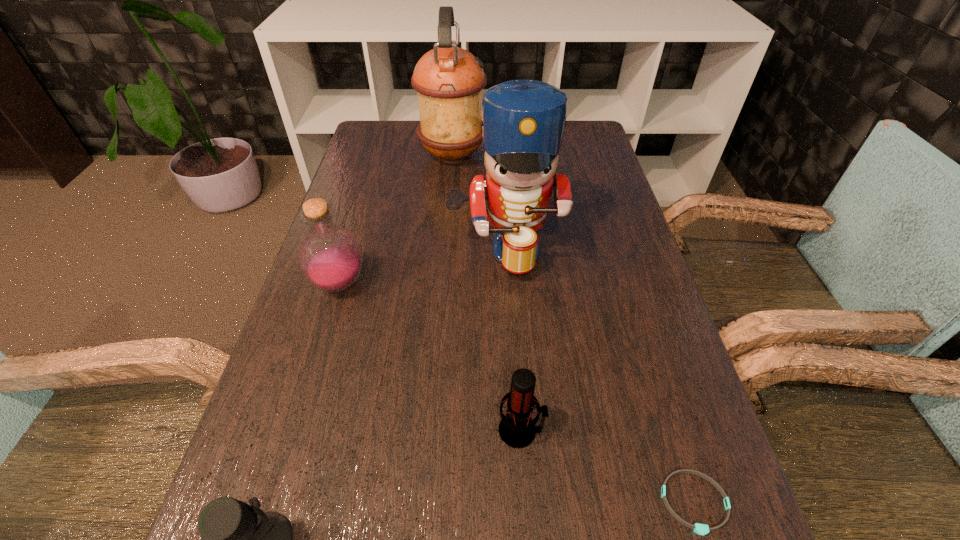
At what (x,y) coordinates should I click in order to perform the action: click on free region located on the left of the right microphone. Please return your answer as a coordinate pair (x, y). Looking at the image, I should click on (323, 430).

This screenshot has height=540, width=960. Find the location of `object that is at the far edge`. object that is at the far edge is located at coordinates (449, 80).

Find the location of a particular element. The image size is (960, 540). object positioned at the left edge is located at coordinates (330, 257).

Where is `object that is positioned at the right edge`? object that is positioned at the right edge is located at coordinates (702, 529).

Identify the location of free space at the left edge of the desktop. [379, 254].

Locate an element on the screen. Image resolution: width=960 pixels, height=540 pixels. free location at the right edge is located at coordinates (589, 159).

At what (x,y) coordinates should I click in order to perform the action: click on free region at the far left corner of the desktop. Please return your answer as a coordinate pair (x, y). The image size is (960, 540). Looking at the image, I should click on (368, 141).

Identify the location of free space at the far right corner of the desktop. The image size is (960, 540). (567, 141).

Find the location of `free space between the rightmost object and the farthest object`. free space between the rightmost object and the farthest object is located at coordinates (573, 329).

The image size is (960, 540). What are the coordinates of `free space between the bottle and the oil lamp` in the screenshot? It's located at (396, 220).